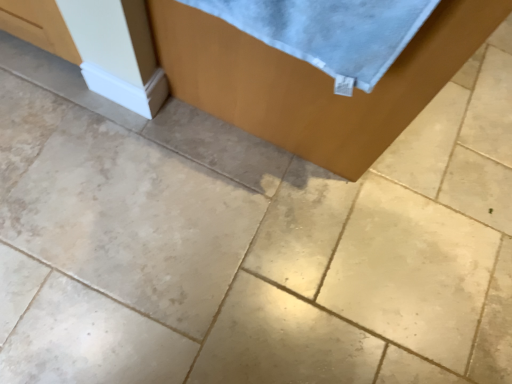
Question: Should I look upward or downward to see light blue cotton towel at upper right?

Choices:
 (A) up
 (B) down

Answer: (A)